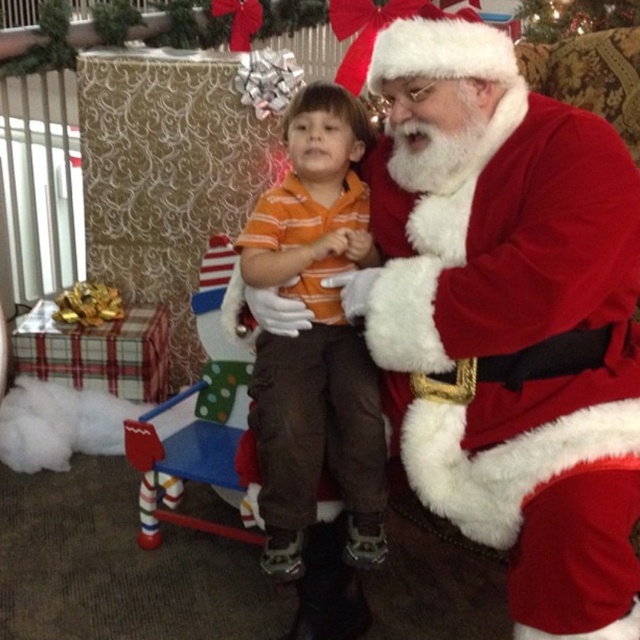
Question: Does orange striped shirt at center have a greater width compared to green textured christmas tree at upper center?

Choices:
 (A) yes
 (B) no

Answer: (B)

Question: Among these points, which one is farthest from the camera?

Choices:
 (A) (330, 182)
 (B) (593, 570)
 (C) (604, 19)

Answer: (C)

Question: Is orange striped shirt at center in front of green textured christmas tree at upper center?

Choices:
 (A) yes
 (B) no

Answer: (A)

Question: Which point is farther to the camera?

Choices:
 (A) fuzzy red santa at center
 (B) orange striped shirt at center
 (C) green textured christmas tree at upper center

Answer: (C)

Question: Among these objects, which one is farthest from the camera?

Choices:
 (A) orange striped shirt at center
 (B) green textured christmas tree at upper center

Answer: (B)

Question: Is orange striped shirt at center positioned at the back of green textured christmas tree at upper center?

Choices:
 (A) no
 (B) yes

Answer: (A)